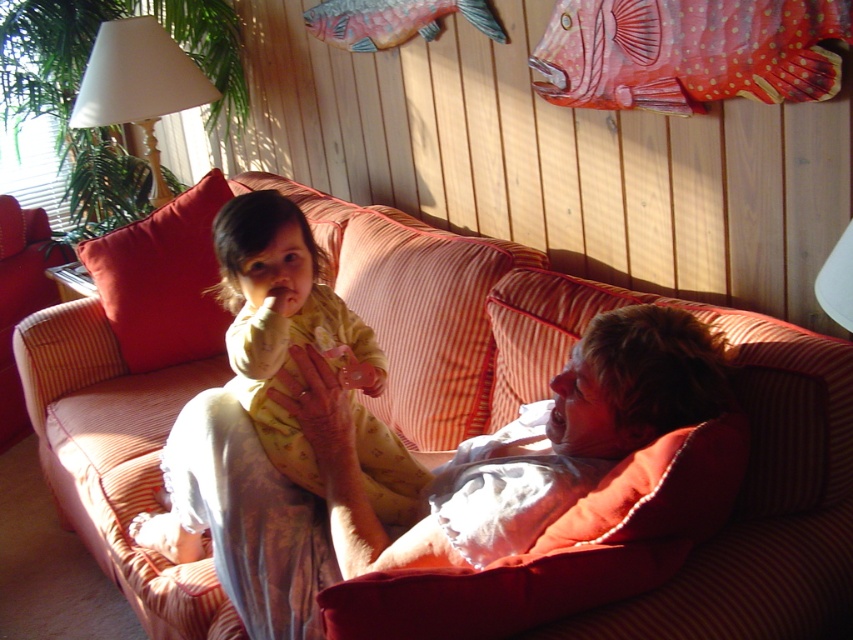
You are standing in the room and want to take a photo of the point at coordinates (206, 397). The camera you are using has a minimum focus distance of 5 feet. Will the camera be able to focus on the point?

The point at coordinates (206, 397) is 4.87 feet away from the camera, which is within the camera minimum focus distance of 5 feet. Therefore, the camera can focus on the point.